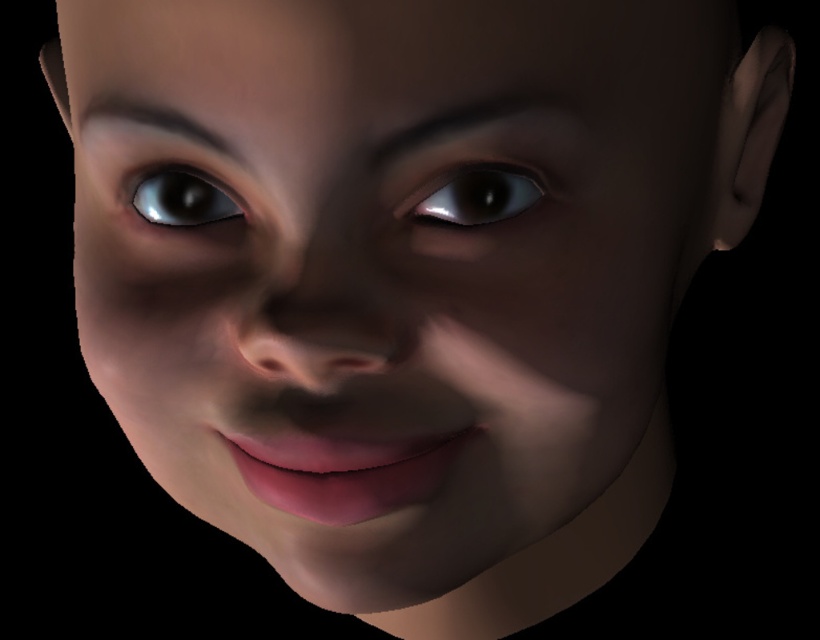
You are an artist examining a digital portrait. You notice two shiny silver eye at center and satin silver eye at center. Which eye is positioned lower on the face?

The satin silver eye at center is positioned lower than the shiny silver eye at center.

You are an artist trying to paint the face shown in the image. You need to decide which eye to focus on first based on their sizes. Which eye should you focus on first, the satin silver eye at center or the shiny silver eye at center?

The shiny silver eye at center is taller than the satin silver eye at center, so you should focus on the shiny silver eye at center first because it is larger in height.

You are an artist analyzing the symmetry of the face in the image. You notice two shiny silver eye at center and satin silver eye at center. Which eye has a greater width?

The satin silver eye at center has a greater width than the shiny silver eye at center according to the description.